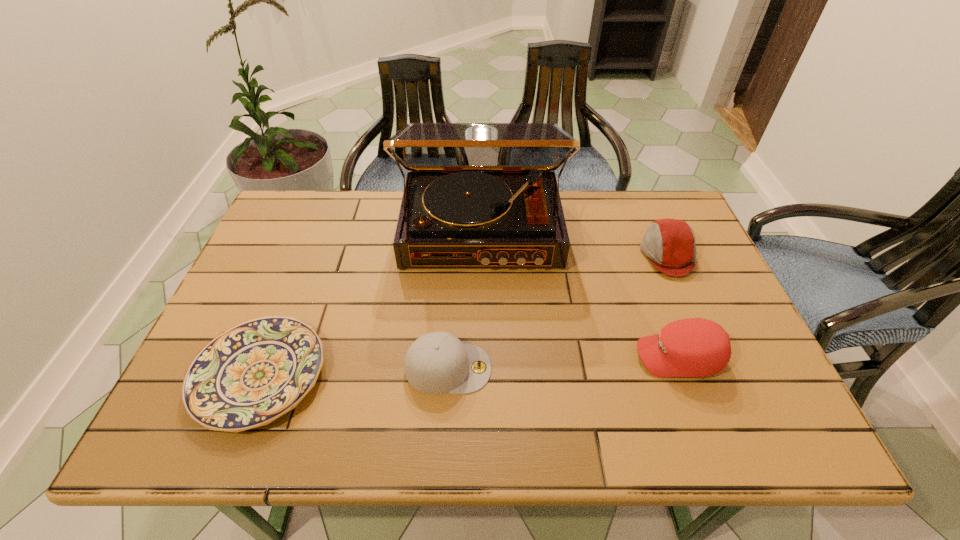
Where is `the tallest object`? Image resolution: width=960 pixels, height=540 pixels. the tallest object is located at coordinates (477, 195).

Where is `the farthest cap`? The image size is (960, 540). the farthest cap is located at coordinates (669, 244).

The image size is (960, 540). What are the coordinates of `the leftmost cap` in the screenshot? It's located at (436, 363).

Locate an element on the screen. the shortest object is located at coordinates (248, 376).

The height and width of the screenshot is (540, 960). In order to click on plate in this screenshot , I will do `click(248, 376)`.

This screenshot has height=540, width=960. I want to click on vacant space positioned on the front-facing side of the tallest object, so [x=482, y=393].

Where is `blank area located on the front-facing side of the farthest cap`? blank area located on the front-facing side of the farthest cap is located at coordinates (503, 255).

The height and width of the screenshot is (540, 960). I want to click on free spot located on the front-facing side of the farthest cap, so click(x=510, y=255).

Locate an element on the screen. This screenshot has width=960, height=540. vacant space situated on the front-facing side of the farthest cap is located at coordinates (581, 255).

Find the location of a particular element. The height and width of the screenshot is (540, 960). free space located on the front-facing side of the leftmost cap is located at coordinates (616, 368).